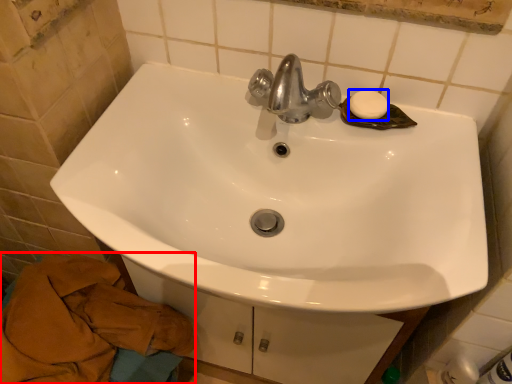
Question: Which object appears farthest to the camera in this image, bath towel (highlighted by a red box) or soap (highlighted by a blue box)?

Choices:
 (A) bath towel
 (B) soap

Answer: (B)